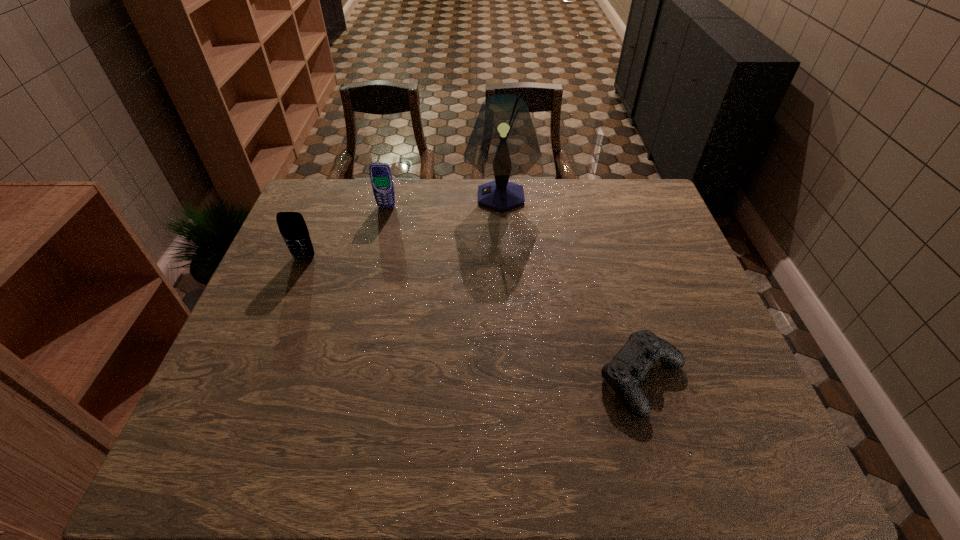
You are a GUI agent. You are given a task and a screenshot of the screen. Output one action in this format:
    pyautogui.click(x=<x>, y=<y>)
    Task: Click on the free location at the left edge of the desktop
    
    Given the screenshot: What is the action you would take?
    pyautogui.click(x=302, y=275)

In the image, there is a desktop. Where is `free space at the right edge`? This screenshot has height=540, width=960. free space at the right edge is located at coordinates (651, 242).

The width and height of the screenshot is (960, 540). Find the location of `blank region between the lampshade and the right cellular telephone`. blank region between the lampshade and the right cellular telephone is located at coordinates (444, 201).

You are a GUI agent. You are given a task and a screenshot of the screen. Output one action in this format:
    pyautogui.click(x=<x>, y=<y>)
    Task: Click on the vacant area that lies between the nearest object and the second object from left to right
    This screenshot has height=540, width=960.
    Given the screenshot: What is the action you would take?
    pyautogui.click(x=515, y=292)

In order to click on free space between the rightmost object and the third farthest object in this screenshot , I will do `click(473, 318)`.

Locate an element on the screen. This screenshot has width=960, height=540. empty space that is in between the farther cellular telephone and the left cellular telephone is located at coordinates (346, 232).

Identify the location of free space between the rightmost object and the left cellular telephone. The image size is (960, 540). (473, 318).

The height and width of the screenshot is (540, 960). I want to click on free space between the left cellular telephone and the control, so click(473, 318).

Where is `free spot between the third farthest object and the lampshade`? This screenshot has height=540, width=960. free spot between the third farthest object and the lampshade is located at coordinates (402, 227).

Where is `vacant region between the nearest object and the right cellular telephone`? This screenshot has width=960, height=540. vacant region between the nearest object and the right cellular telephone is located at coordinates (515, 292).